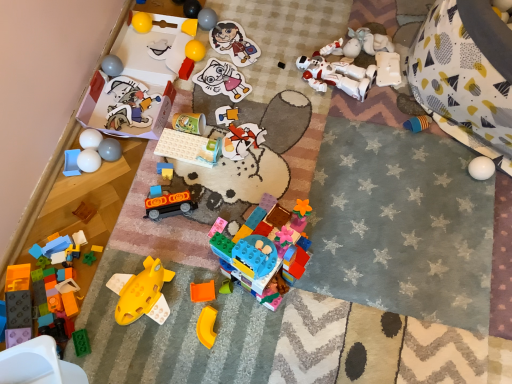
Identify the location of free space in front of yellow matte plastic piece at center, the seventeenth toy viewed from the left. The width and height of the screenshot is (512, 384). [206, 366].